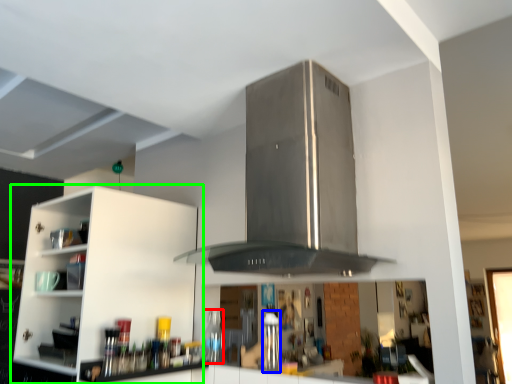
Question: Which object is positioned closest to bottle (highlighted by a red box)? Select from appliance (highlighted by a blue box) and cabinetry (highlighted by a green box).

Choices:
 (A) appliance
 (B) cabinetry

Answer: (A)